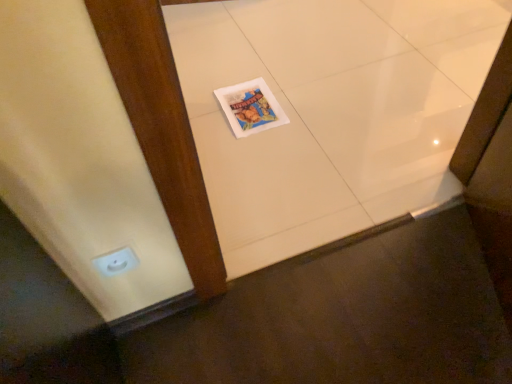
The width and height of the screenshot is (512, 384). I want to click on free space behind matte paper magazine at center, so click(248, 67).